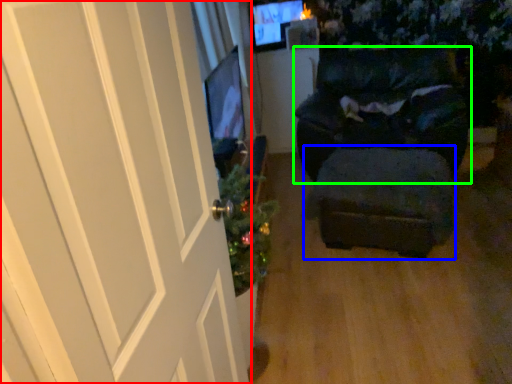
Question: Which is farther away from door (highlighted by a red box)? stool (highlighted by a blue box) or furniture (highlighted by a green box)?

Choices:
 (A) stool
 (B) furniture

Answer: (B)